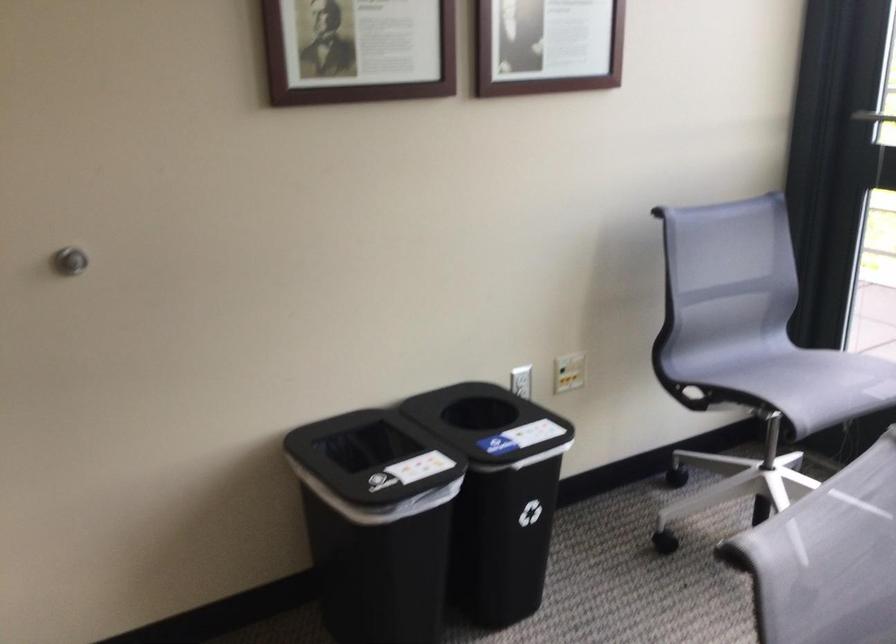
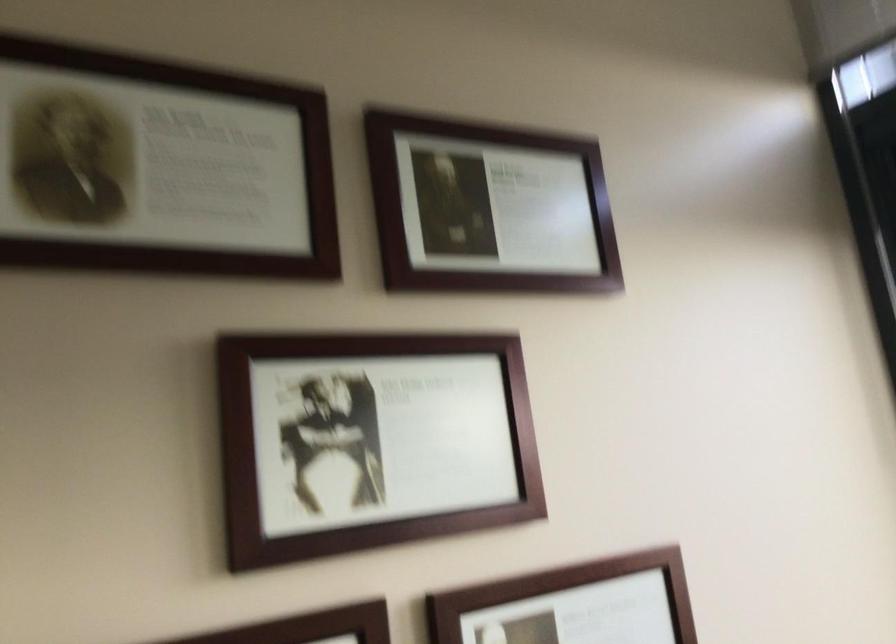
Question: Based on the continuous images, in which direction is the camera rotating? Reply with the corresponding letter.

Choices:
 (A) Left
 (B) Right
 (C) Up
 (D) Down

Answer: (C)